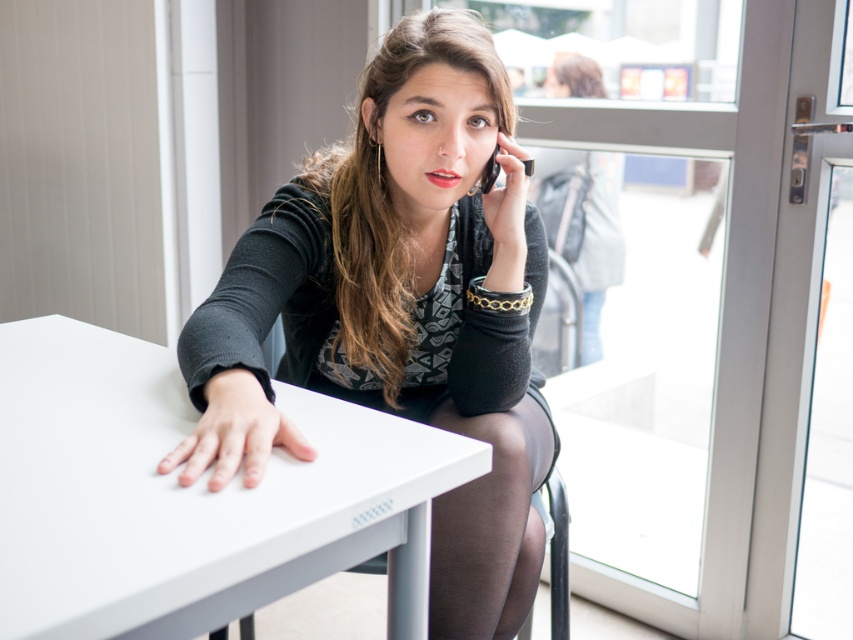
Question: Which point appears closest to the camera in this image?

Choices:
 (A) (488, 166)
 (B) (445, 621)
 (C) (410, 474)
 (D) (628, 500)

Answer: (C)

Question: Can you confirm if matte black sweater at center is positioned below black plastic phone at upper center?

Choices:
 (A) yes
 (B) no

Answer: (A)

Question: Is the position of white matte table at center less distant than that of transparent glass door at upper center?

Choices:
 (A) no
 (B) yes

Answer: (B)

Question: Which object is closer to the camera taking this photo?

Choices:
 (A) black plastic phone at upper center
 (B) transparent glass door at upper center
 (C) white matte table at center

Answer: (C)

Question: Does matte black sweater at center have a larger size compared to white matte table at center?

Choices:
 (A) yes
 (B) no

Answer: (A)

Question: Estimate the real-world distances between objects in this image. Which object is closer to the white matte table at center?

Choices:
 (A) matte black sweater at center
 (B) black plastic phone at upper center

Answer: (A)